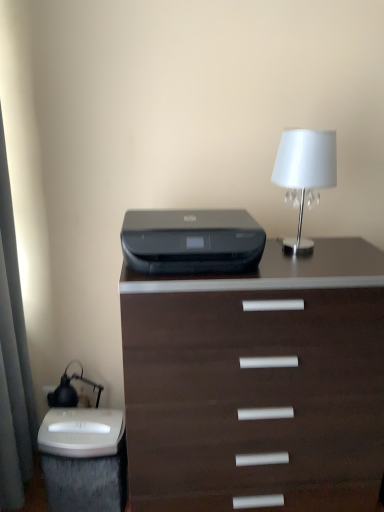
Where is `vacant space in front of white glossy lampshade at upper right`? This screenshot has height=512, width=384. vacant space in front of white glossy lampshade at upper right is located at coordinates (314, 268).